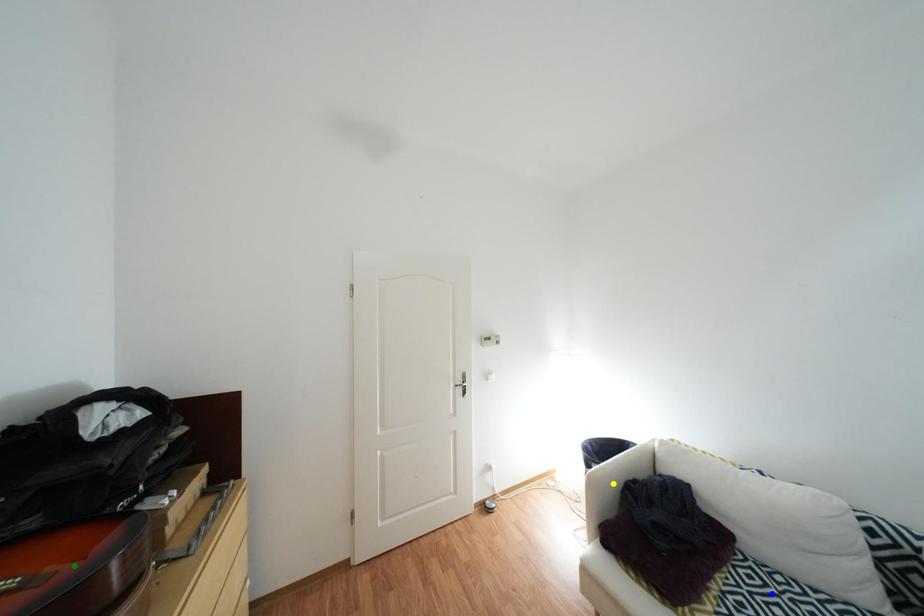
In the scene shown: Order these from farthest to nearest:
yellow point, green point, blue point

yellow point < blue point < green point